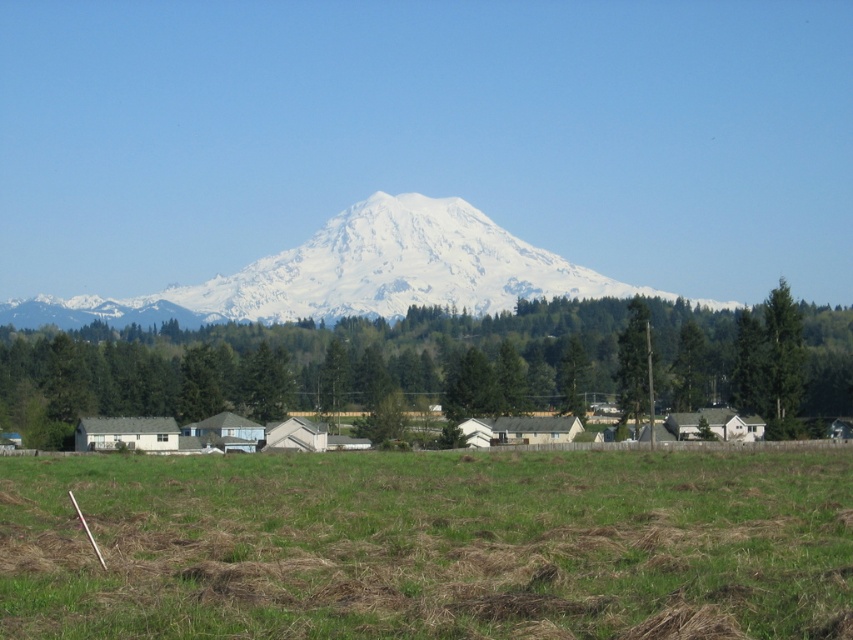
You are standing in the open grassy field and want to walk towards the green textured tree at center. Which direction should you move relative to the green grass at lower center?

You should move away from the green grass at lower center because the green textured tree at center is further away from the viewer than the green grass at lower center.

You are standing at the edge of the open grassy field and want to walk towards the green textured tree at center. Which direction should you walk to reach it without crossing the green grass at lower center?

You should walk to the right or left of the green grass at lower center since its width is narrower than the green textured tree at center, allowing you to bypass it while heading towards the tree.